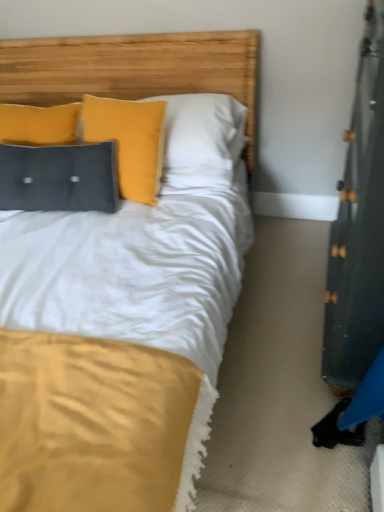
Question: Considering the positions of velvet-like dark gray pillow at upper left and wooden headboard at upper center in the image, is velvet-like dark gray pillow at upper left taller or shorter than wooden headboard at upper center?

Choices:
 (A) short
 (B) tall

Answer: (A)

Question: Considering the positions of velvet-like dark gray pillow at upper left and wooden headboard at upper center in the image, is velvet-like dark gray pillow at upper left bigger or smaller than wooden headboard at upper center?

Choices:
 (A) small
 (B) big

Answer: (A)

Question: From a real-world perspective, is velvet-like dark gray pillow at upper left positioned above or below wooden headboard at upper center?

Choices:
 (A) above
 (B) below

Answer: (B)

Question: From the image's perspective, relative to velvet-like dark gray pillow at upper left, is wooden headboard at upper center above or below?

Choices:
 (A) below
 (B) above

Answer: (B)

Question: Considering the relative positions of wooden headboard at upper center and velvet-like dark gray pillow at upper left in the image provided, is wooden headboard at upper center to the left or to the right of velvet-like dark gray pillow at upper left?

Choices:
 (A) left
 (B) right

Answer: (B)

Question: Is point (160, 47) positioned closer to the camera than point (39, 166)?

Choices:
 (A) closer
 (B) farther

Answer: (B)

Question: Relative to velvet-like dark gray pillow at upper left, is wooden headboard at upper center in front or behind?

Choices:
 (A) front
 (B) behind

Answer: (A)